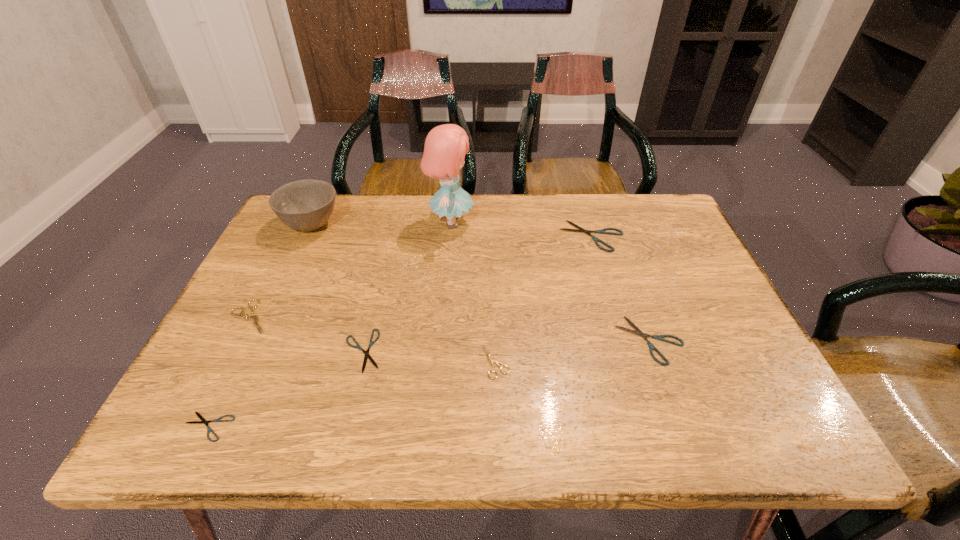
At what (x,y) coordinates should I click in order to perform the action: click on the third biggest black shears. Please return your answer as a coordinate pair (x, y). Looking at the image, I should click on (371, 342).

The image size is (960, 540). I want to click on the third black shears from right to left, so click(371, 342).

Identify the location of the nearest object. (203, 420).

You are a GUI agent. You are given a task and a screenshot of the screen. Output one action in this format:
    pyautogui.click(x=<x>, y=<y>)
    Task: Click on the shortest shears
    The width and height of the screenshot is (960, 540).
    Given the screenshot: What is the action you would take?
    pyautogui.click(x=203, y=420)

Where is `vacant space situated on the front-facing side of the doll`? The image size is (960, 540). vacant space situated on the front-facing side of the doll is located at coordinates (503, 222).

You are a GUI agent. You are given a task and a screenshot of the screen. Output one action in this format:
    pyautogui.click(x=<x>, y=<y>)
    Task: Click on the free region located 0.200m on the right of the bowl
    The image size is (960, 540).
    Given the screenshot: What is the action you would take?
    pyautogui.click(x=410, y=225)

Find the location of a particular element. vacant space located 0.170m on the right of the farthest shears is located at coordinates (684, 236).

Where is `vacant region located 0.290m on the right of the farther beige shears`? vacant region located 0.290m on the right of the farther beige shears is located at coordinates (397, 317).

The height and width of the screenshot is (540, 960). Find the location of `free space located 0.260m on the back of the third smallest black shears`. free space located 0.260m on the back of the third smallest black shears is located at coordinates (616, 246).

Image resolution: width=960 pixels, height=540 pixels. I want to click on vacant area located on the right of the third shears from right to left, so click(x=675, y=362).